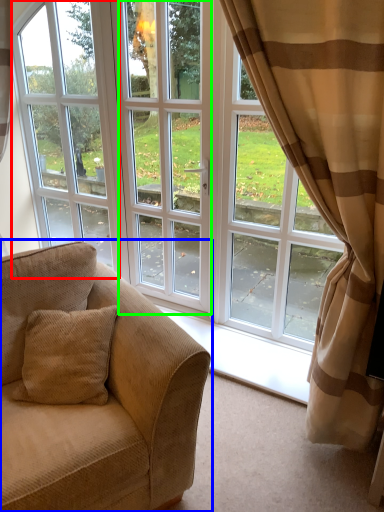
Question: Based on their relative distances, which object is farther from window frame (highlighted by a red box)? Choose from studio couch (highlighted by a blue box) and screen door (highlighted by a green box).

Choices:
 (A) studio couch
 (B) screen door

Answer: (A)